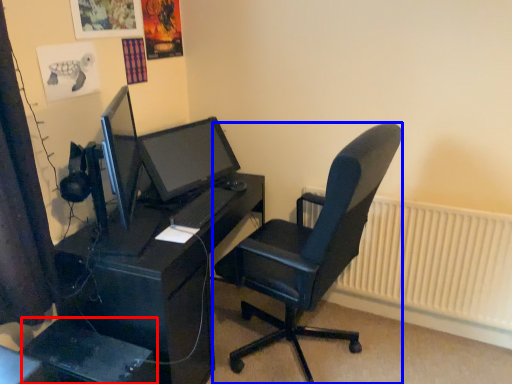
Question: Which point is further to the camera, computer tower (highlighted by a red box) or chair (highlighted by a blue box)?

Choices:
 (A) computer tower
 (B) chair

Answer: (A)